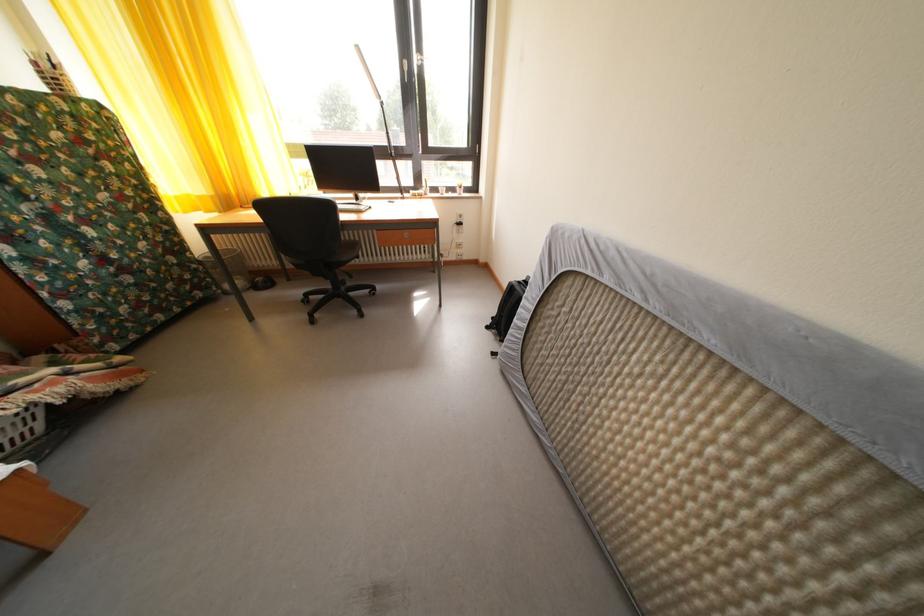
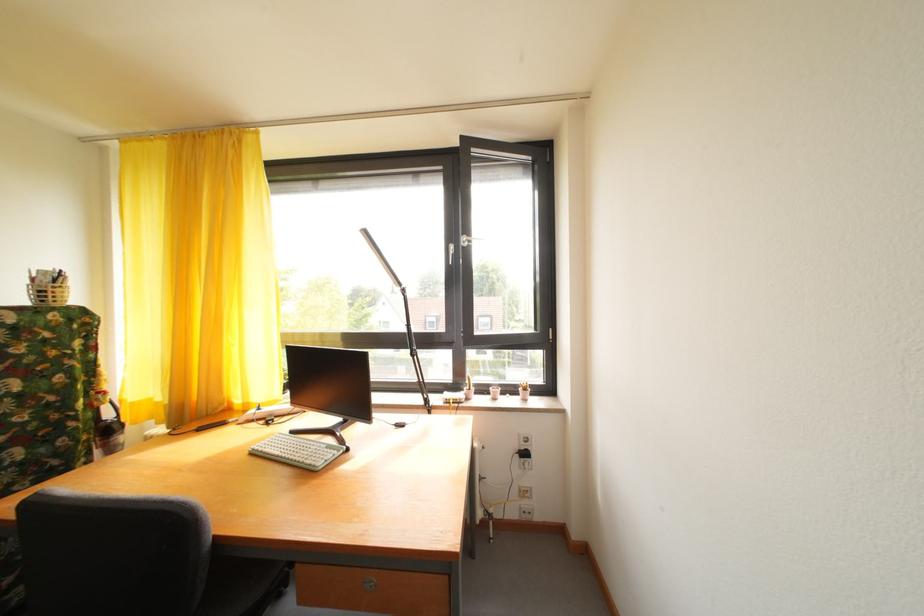
Where in the second image is the point corresponding to (x=460, y=196) from the first image?

(520, 395)